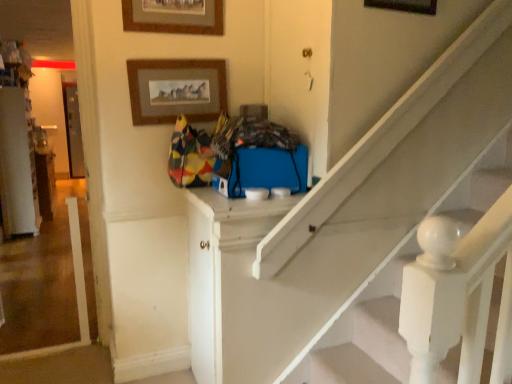
Question: Is matte blue door at upper center, the 1th door in the top-to-bottom sequence, in front of or behind wooden picture frame at upper center, which is counted as the 1th picture frame, starting from the left, in the image?

Choices:
 (A) front
 (B) behind

Answer: (A)

Question: Considering the positions of matte blue door at upper center, marked as the 1th door in a right-to-left arrangement, and wooden picture frame at upper center, the 3th picture frame when ordered from right to left, in the image, is matte blue door at upper center, marked as the 1th door in a right-to-left arrangement, taller or shorter than wooden picture frame at upper center, the 3th picture frame when ordered from right to left,?

Choices:
 (A) tall
 (B) short

Answer: (A)

Question: Which object is positioned closest to the white painted wood door at center, the first door in the bottom-to-top sequence?

Choices:
 (A) matte blue door at upper center, marked as the 1th door in a right-to-left arrangement
 (B) wooden picture frame at upper center, which is the first picture frame in right-to-left order
 (C) wooden picture frame at upper center, which is counted as the 1th picture frame, starting from the left
 (D) wooden picture frame at upper center, which ranks as the 2th picture frame in left-to-right order

Answer: (D)

Question: Which of these objects is positioned farthest from the wooden picture frame at upper center, which is the first picture frame in right-to-left order?

Choices:
 (A) matte blue door at upper center, the 1th door in the top-to-bottom sequence
 (B) wooden picture frame at upper center, the 2th picture frame when ordered from right to left
 (C) white painted wood door at center, placed as the second door when sorted from right to left
 (D) wooden picture frame at upper center, which is counted as the 1th picture frame, starting from the left

Answer: (C)